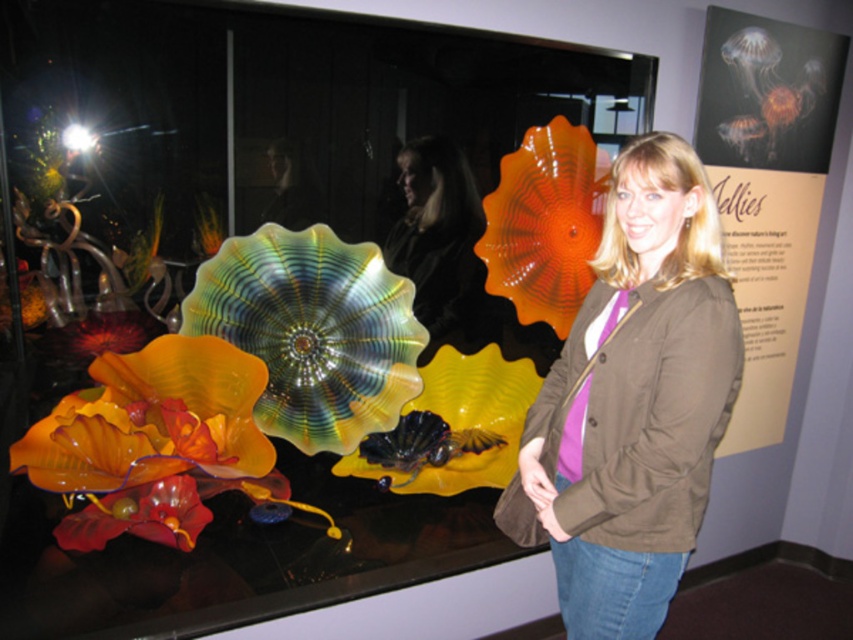
Can you confirm if translucent orange glass flower at center is bigger than matte black jacket at center?

Correct, translucent orange glass flower at center is larger in size than matte black jacket at center.

Does point (572, 260) come closer to viewer compared to point (433, 198)?

That is True.

The image size is (853, 640). I want to click on translucent orange glass flower at center, so click(544, 224).

This screenshot has width=853, height=640. In order to click on translucent glass flower at lower left in this screenshot , I will do pos(149,440).

Does brown fabric jacket at center have a greater width compared to translucent orange glass flower at center?

Correct, the width of brown fabric jacket at center exceeds that of translucent orange glass flower at center.

Can you confirm if brown fabric jacket at center is taller than translucent orange glass flower at center?

Yes, brown fabric jacket at center is taller than translucent orange glass flower at center.

Is point (657, 531) farther from camera compared to point (589, 140)?

No, it is not.

The width and height of the screenshot is (853, 640). I want to click on brown fabric jacket at center, so click(x=633, y=401).